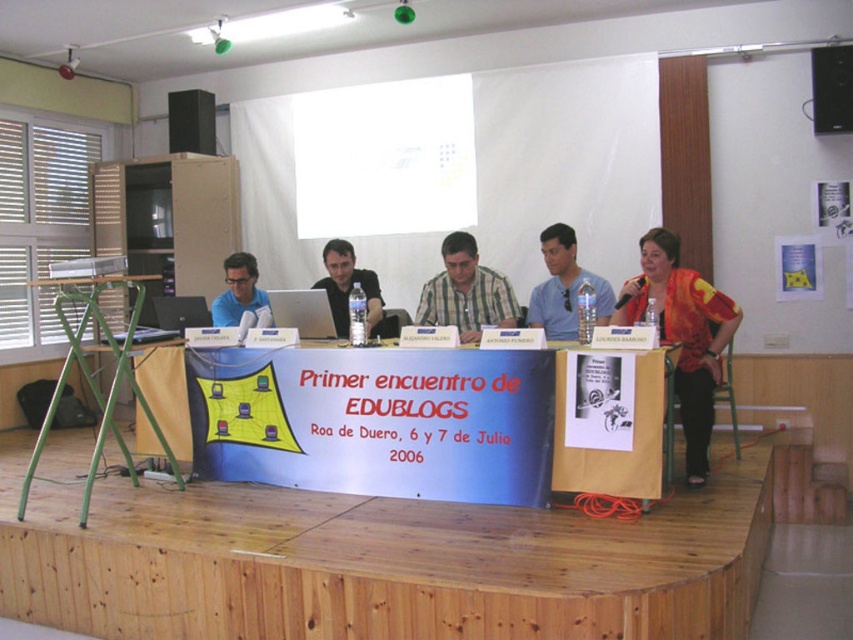
Who is more forward, [556,438] or [457,323]?

Point [556,438] is in front.

Between white cardboard table at center and checkered fabric shirt at center, which one has less height?

→ checkered fabric shirt at center

This screenshot has height=640, width=853. I want to click on white cardboard table at center, so click(398, 420).

Which of these two, checkered fabric shirt at center or black plastic speaker at upper right, stands shorter?

With less height is black plastic speaker at upper right.

Between point (427, 284) and point (844, 116), which one is positioned in front?

Point (427, 284) is more forward.

Find the location of a particular element. checkered fabric shirt at center is located at coordinates [x=466, y=292].

How far apart are orange fabric shirt at right and silver metallic laptop at center?

orange fabric shirt at right and silver metallic laptop at center are 1.80 meters apart.

What are the coordinates of `orange fabric shirt at right` in the screenshot? It's located at (683, 333).

Find the location of a particular element. orange fabric shirt at right is located at coordinates (683, 333).